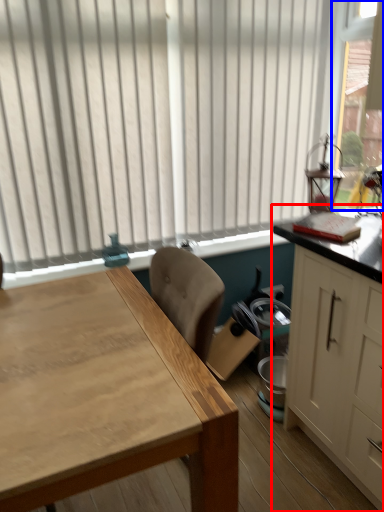
Question: Which point is closer to the camera, cabinetry (highlighted by a red box) or window screen (highlighted by a blue box)?

Choices:
 (A) cabinetry
 (B) window screen

Answer: (A)